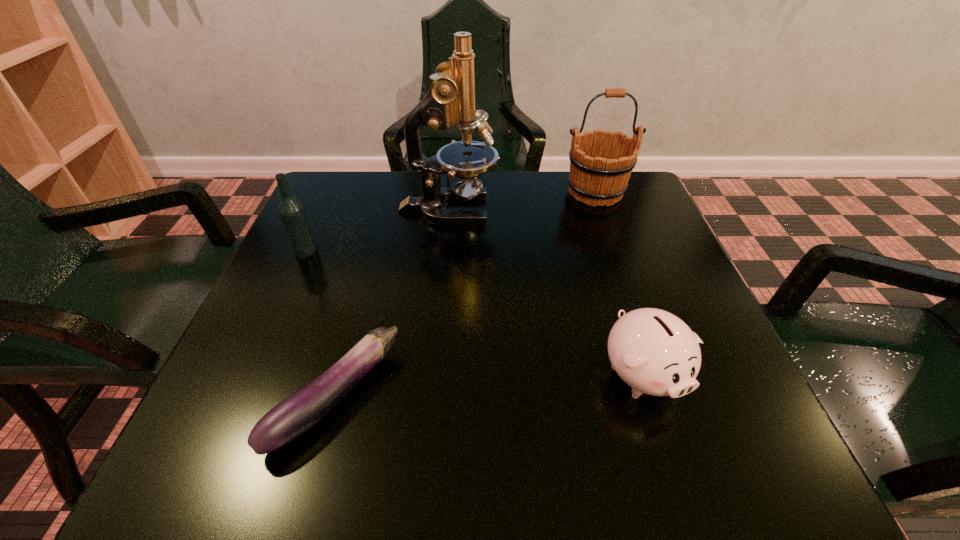
Locate an element on the screen. The height and width of the screenshot is (540, 960). free space located 0.070m on the left of the eggplant is located at coordinates (231, 399).

Locate an element on the screen. The image size is (960, 540). microscope at the far edge is located at coordinates (450, 100).

Find the location of a particular element. Image resolution: width=960 pixels, height=540 pixels. wine bucket positioned at the far edge is located at coordinates (598, 176).

I want to click on piggy bank situated at the near edge, so click(x=653, y=351).

Where is `eggplant that is at the near edge`? eggplant that is at the near edge is located at coordinates (293, 416).

Where is `vodka that is positioned at the left edge`? The image size is (960, 540). vodka that is positioned at the left edge is located at coordinates (292, 213).

At what (x,y) coordinates should I click in order to perform the action: click on eggplant at the left edge. Please return your answer as a coordinate pair (x, y). Looking at the image, I should click on (293, 416).

Where is `wine bucket that is at the right edge`? The height and width of the screenshot is (540, 960). wine bucket that is at the right edge is located at coordinates (598, 176).

Identify the location of piggy bank located at the right edge. (653, 351).

Find the location of a particular element. object that is positioned at the near left corner is located at coordinates (293, 416).